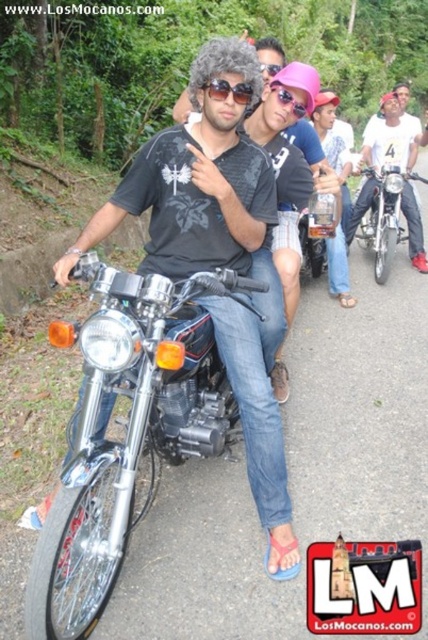
Can you confirm if shiny chrome motorcycle at center is taller than sunglassestransparent at upper center?

Yes.

Is point (412, 204) closer to camera compared to point (267, 72)?

No, (412, 204) is behind (267, 72).

Does point (372, 208) lie in front of point (272, 67)?

No.

Identify the location of shiny chrome motorcycle at center. (388, 216).

Between matte black shirt at center and glossy plastic goggles at center, which one has less height?

Standing shorter between the two is glossy plastic goggles at center.

Between point (244, 406) and point (278, 100), which one is positioned behind?

Positioned behind is point (278, 100).

Does point (213, 216) lie behind point (294, 115)?

That is False.

The image size is (428, 640). In order to click on matte black shirt at center in this screenshot , I will do `click(196, 180)`.

Can you confirm if shiny chrome motorcycle at center is positioned to the left of sunglasses at center?

Incorrect, shiny chrome motorcycle at center is not on the left side of sunglasses at center.

Does shiny chrome motorcycle at center have a larger size compared to sunglasses at center?

Correct, shiny chrome motorcycle at center is larger in size than sunglasses at center.

Is point (406, 166) positioned before point (214, 83)?

No, (406, 166) is further to viewer.

Locate an element on the screen. shiny chrome motorcycle at center is located at coordinates (388, 216).